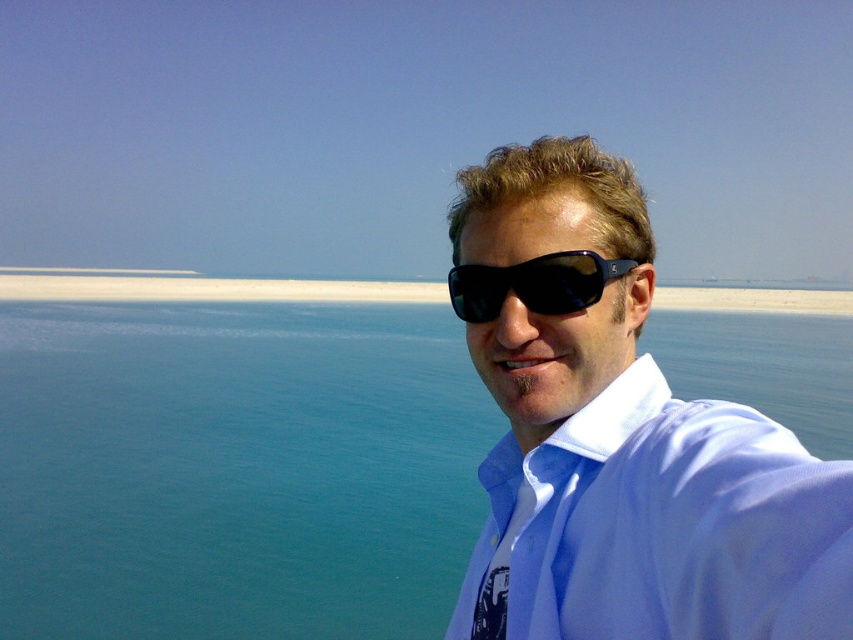
How distant is blue water at center from matte black sunglasses at upper right?

They are 10.56 meters apart.

From the picture: Between blue water at center and matte black sunglasses at upper right, which one appears on the left side from the viewer's perspective?

matte black sunglasses at upper right is more to the left.

Image resolution: width=853 pixels, height=640 pixels. What do you see at coordinates (236, 468) in the screenshot?
I see `blue water at center` at bounding box center [236, 468].

In order to click on blue water at center in this screenshot , I will do point(236,468).

Does matte black sunglasses at upper right lie in front of black plastic sunglasses at center?

Yes, it is.

Does point (728, 426) lie behind point (619, 259)?

No, (728, 426) is closer to viewer.

The image size is (853, 640). I want to click on matte black sunglasses at upper right, so click(619, 436).

Between blue water at center and black plastic sunglasses at center, which one is positioned lower?

blue water at center

Consider the image. Which is more to the left, blue water at center or black plastic sunglasses at center?

Positioned to the left is black plastic sunglasses at center.

The height and width of the screenshot is (640, 853). What are the coordinates of `blue water at center` in the screenshot? It's located at (236, 468).